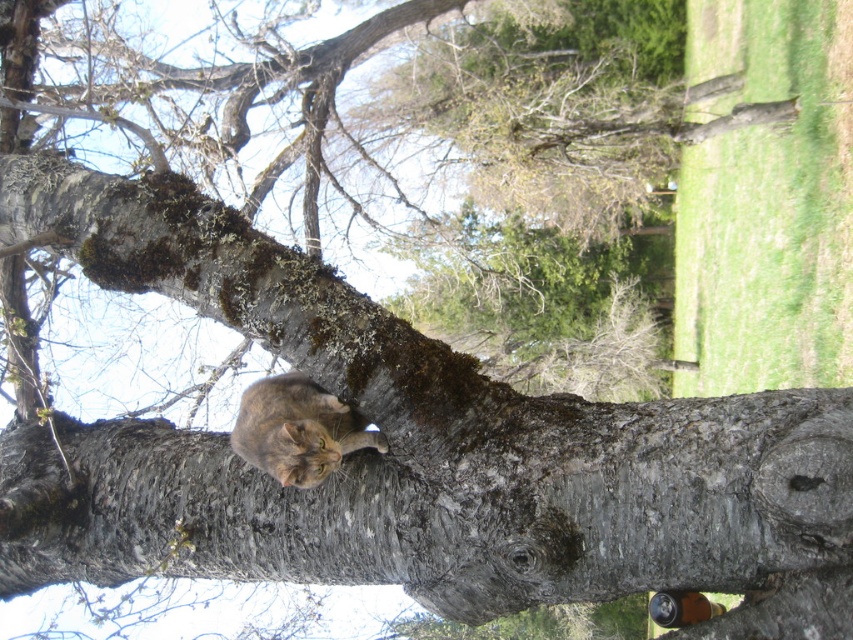
Find the location of a particular element. smooth gray bark at center is located at coordinates (453, 506).

Who is more distant from viewer, (605,561) or (321,429)?

The point (321,429) is more distant.

Identify the location of smooth gray bark at center. (453, 506).